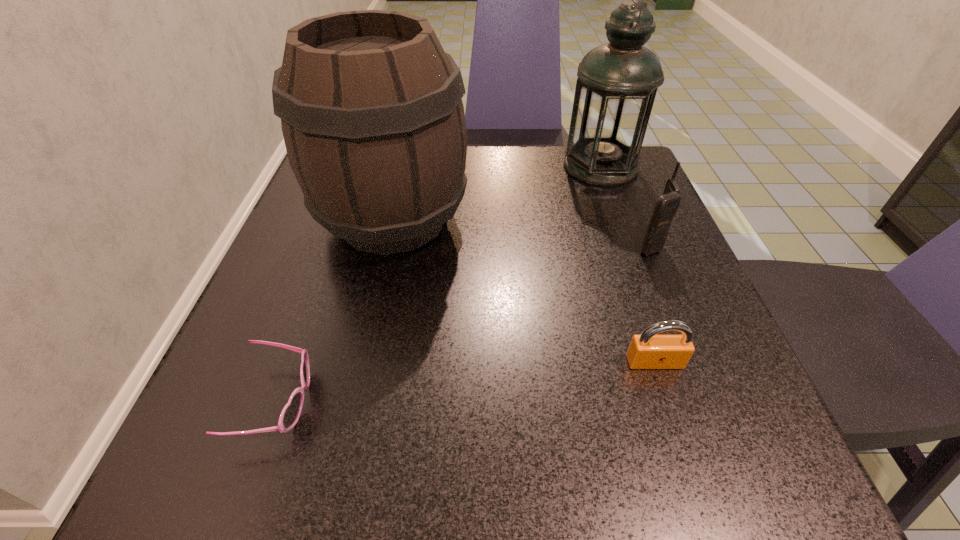
Locate an element on the screen. vacant area that satisfies the following two spatial constraints: 1. on the front side of the tallest object; 2. on the front-facing side of the sunglasses is located at coordinates (685, 401).

Locate an element on the screen. Image resolution: width=960 pixels, height=540 pixels. free space that satisfies the following two spatial constraints: 1. on the keyboard of the third tallest object; 2. to unlock the padlock from the front is located at coordinates (697, 362).

Find the location of a particular element. The height and width of the screenshot is (540, 960). free point that satisfies the following two spatial constraints: 1. on the back side of the fourth shortest object; 2. on the left side of the tallest object is located at coordinates (405, 166).

Locate an element on the screen. Image resolution: width=960 pixels, height=540 pixels. vacant space that satisfies the following two spatial constraints: 1. to unlock the fourth tallest object from the front; 2. on the front-facing side of the sunglasses is located at coordinates (668, 401).

You are a GUI agent. You are given a task and a screenshot of the screen. Output one action in this format:
    pyautogui.click(x=<x>, y=<y>)
    Task: Click on the free space that satisfies the following two spatial constraints: 1. on the keyboard of the cellular telephone; 2. to unlock the padlock from the front
    The width and height of the screenshot is (960, 540).
    Given the screenshot: What is the action you would take?
    (x=697, y=362)